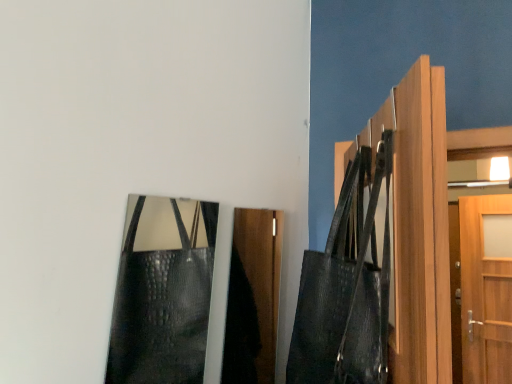
Question: Visually, is leather textured shoulder bag at upper right positioned to the left or to the right of light brown wood door at right?

Choices:
 (A) left
 (B) right

Answer: (A)

Question: Is leather textured shoulder bag at upper right bigger or smaller than light brown wood door at right?

Choices:
 (A) big
 (B) small

Answer: (A)

Question: Considering the real-world distances, which object is closest to the light brown wood door at right?

Choices:
 (A) shiny black leather bag at lower left
 (B) leather textured shoulder bag at upper right

Answer: (B)

Question: Based on their relative distances, which object is nearer to the leather textured shoulder bag at upper right?

Choices:
 (A) shiny black leather bag at lower left
 (B) light brown wood door at right

Answer: (B)